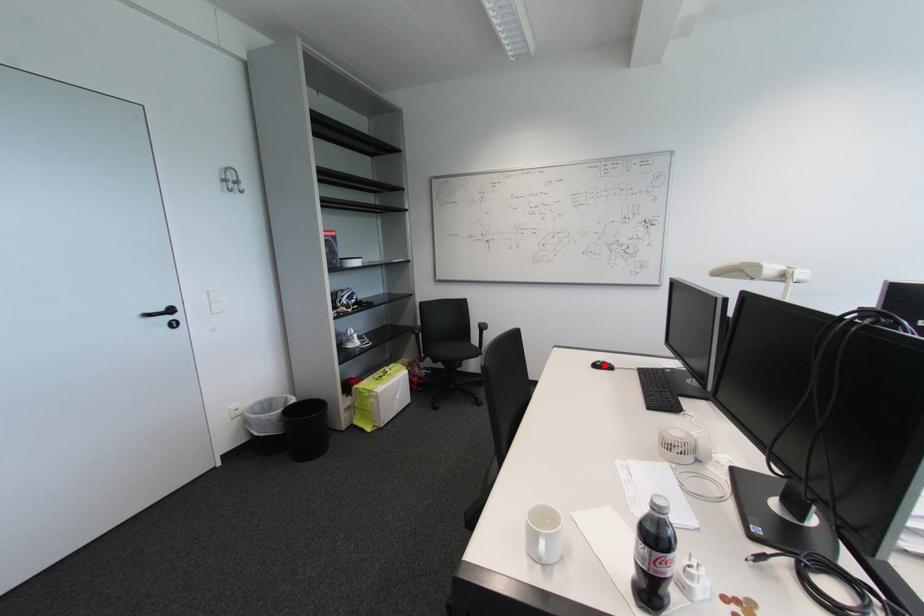
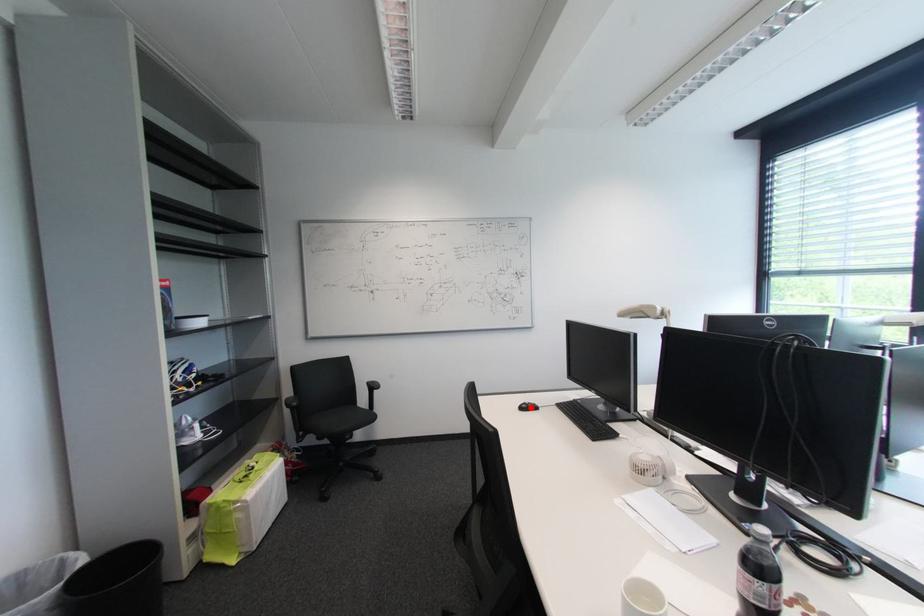
I am providing you with two images of the same scene from different viewpoints. A red point is marked on the first image and another point is marked on the second image. Do the highlighted points in image1 and image2 indicate the same real-world spot?

Yes